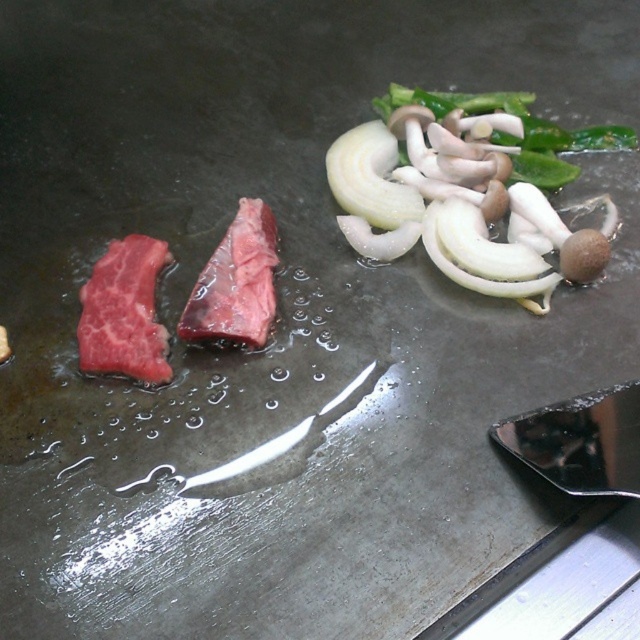
You are a chef preparing a dish and need to flip the pink raw steak at center. However, there is a white translucent onion at upper right in the way. Can you flip the steak without moving the onion?

The pink raw steak at center is behind the white translucent onion at upper right, so you can flip the steak without moving the onion because it is not blocking the steak directly.

You are a chef preparing a dish and need to arrange ingredients on the grill. You have a white translucent onion at upper right and a pink raw steak at center. Which ingredient should you place closer to the edge of the grill to avoid burning, considering their sizes?

The white translucent onion at upper right is bigger than the pink raw steak at center, so it should be placed closer to the edge of the grill to avoid burning.

You are a chef preparing a dish and need to flip the red raw steak at left. However, there is a white translucent onion at upper right in the way. Can you flip the steak without moving the onion?

The red raw steak at left is behind the white translucent onion at upper right, so you can flip the steak without moving the onion because it is positioned behind and not blocking access.